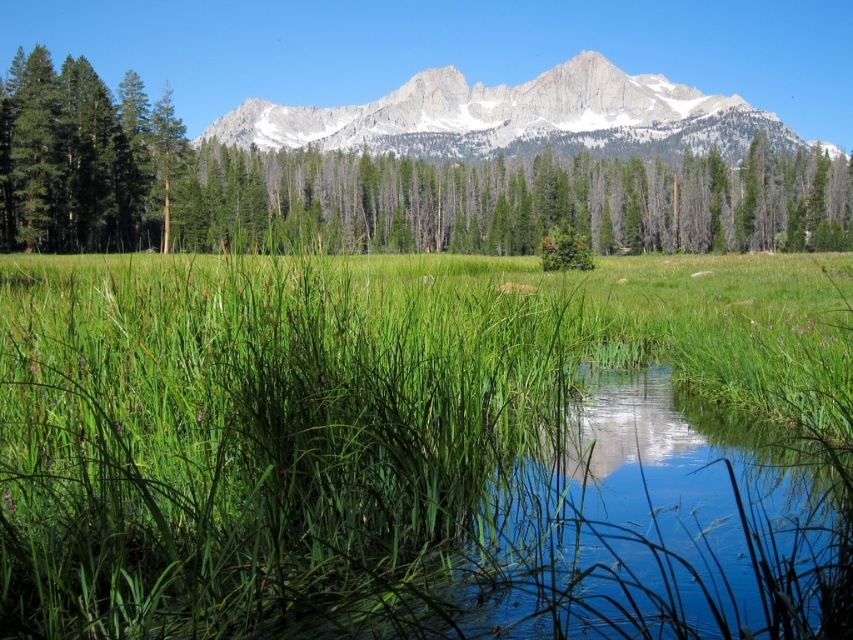
You are an artist planning to paint the landscape. You want to ensure the white rocky mountain range at upper center and the green matte tree at left are proportionally accurate. Which object should you make wider in your painting?

The white rocky mountain range at upper center should be made wider in the painting since its width surpasses that of the green matte tree at left according to the description.

You are a hiker standing in the open grassland and see the green matte tree at center and the white rocky mountain range at upper center. Which object is closer to you?

The green matte tree at center is closer to you than the white rocky mountain range at upper center because it is positioned in front of it.

You are standing at the point labeled point (189, 160) and want to walk towards the point labeled point (686, 141). Which direction should you face to move towards it?

You should face downward because point (686, 141) is further from the camera compared to point (189, 160).